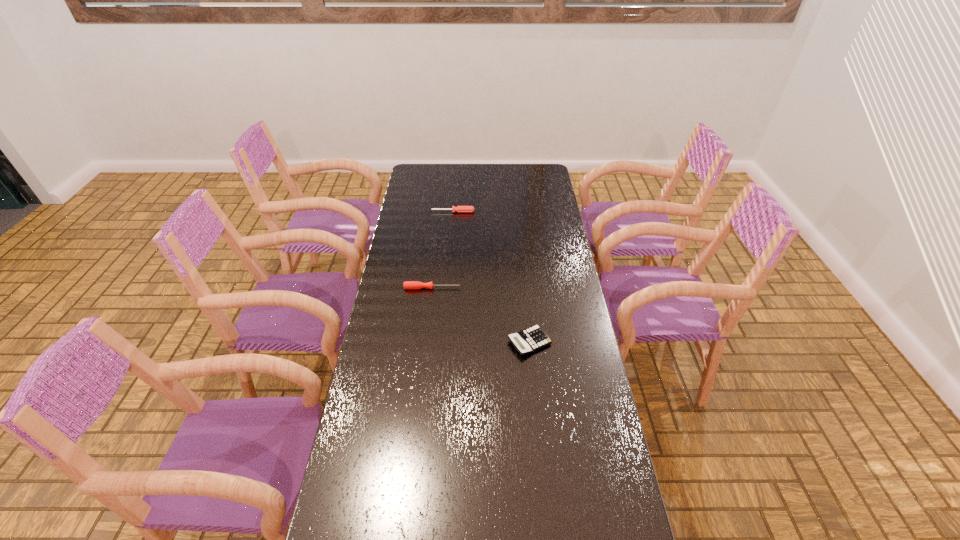
Locate an element on the screen. This screenshot has width=960, height=540. the farthest object is located at coordinates (459, 208).

Image resolution: width=960 pixels, height=540 pixels. In order to click on the rightmost object in this screenshot , I will do `click(529, 340)`.

You are a GUI agent. You are given a task and a screenshot of the screen. Output one action in this format:
    pyautogui.click(x=<x>, y=<y>)
    Task: Click on the nearest object
    The width and height of the screenshot is (960, 540).
    Given the screenshot: What is the action you would take?
    pyautogui.click(x=529, y=340)

Find the location of a particular element. The height and width of the screenshot is (540, 960). the nearer screwdriver is located at coordinates (413, 285).

I want to click on blank area located 0.070m on the right of the farther screwdriver, so click(490, 212).

Find the location of a particular element. free space located 0.100m on the back of the rightmost object is located at coordinates (525, 306).

The image size is (960, 540). I want to click on free point located 0.380m at the tip of the second nearest object, so click(561, 288).

I want to click on object present at the right edge, so click(x=529, y=340).

This screenshot has width=960, height=540. Identify the location of vacant space at the far edge. (485, 174).

The height and width of the screenshot is (540, 960). I want to click on vacant space at the left edge, so click(359, 391).